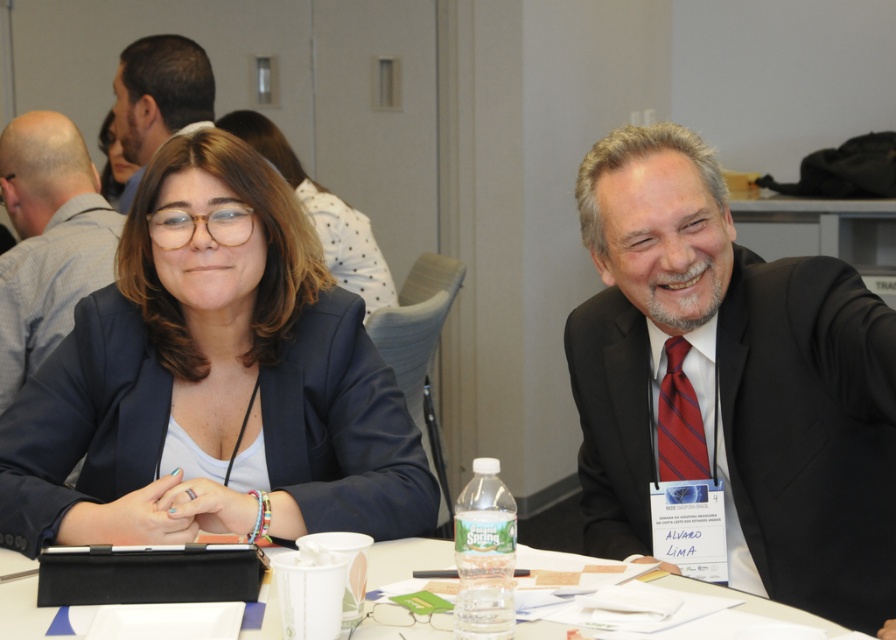
Image resolution: width=896 pixels, height=640 pixels. Find the location of `dark suit at right`. dark suit at right is located at coordinates [x=730, y=388].

Does dark suit at right have a lesser height compared to matte black suit at center?

No, dark suit at right is not shorter than matte black suit at center.

Between dark suit at right and matte black suit at center, which one is positioned lower?

dark suit at right

You are a GUI agent. You are given a task and a screenshot of the screen. Output one action in this format:
    pyautogui.click(x=<x>, y=<y>)
    Task: Click on the dark suit at right
    
    Given the screenshot: What is the action you would take?
    pyautogui.click(x=730, y=388)

Which is more to the left, matte black blazer at center or gray fabric shirt at upper left?

From the viewer's perspective, gray fabric shirt at upper left appears more on the left side.

Which of these two, matte black blazer at center or gray fabric shirt at upper left, stands shorter?

Standing shorter between the two is matte black blazer at center.

This screenshot has height=640, width=896. In order to click on matte black blazer at center in this screenshot , I will do pyautogui.click(x=212, y=381).